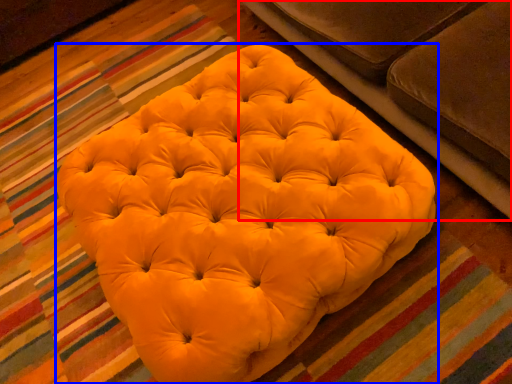
Question: Which object is further to the camera taking this photo, studio couch (highlighted by a red box) or furniture (highlighted by a blue box)?

Choices:
 (A) studio couch
 (B) furniture

Answer: (B)